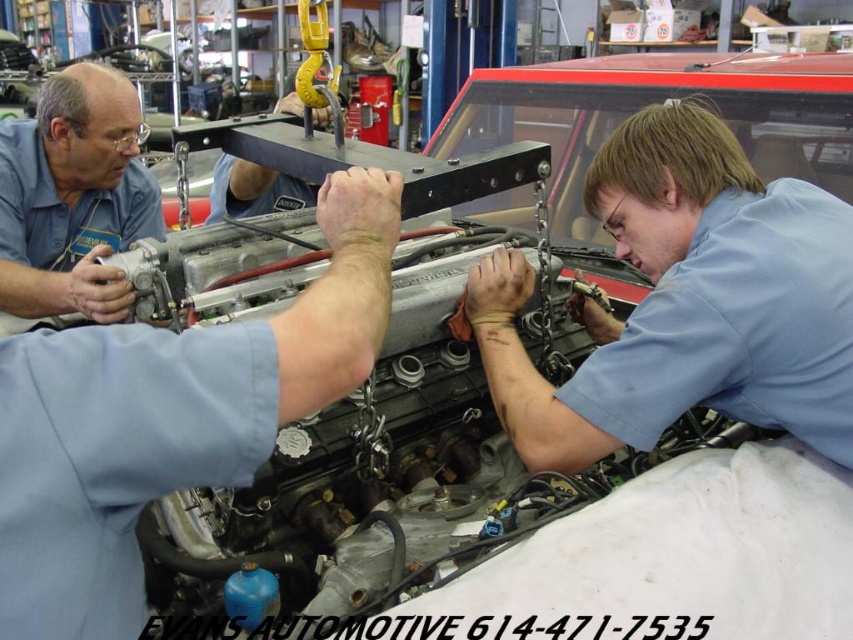
You are a mechanic who needs to reach into the engine bay of the matte silver engine at center. Given that your arm can extend 3 feet, will you be able to reach the components inside without moving closer?

The matte silver engine at center is 3.80 feet away from the viewer. Since your arm can only extend 3 feet, you will not be able to reach the components inside without moving closer.

From the picture: You are a new mechanic in the shop and need to identify the engine and the shirt. Which object is narrower between the matte silver engine at center and the matte blue shirt at upper left?

The matte silver engine at center is thinner than the matte blue shirt at upper left, so the matte silver engine at center is narrower.